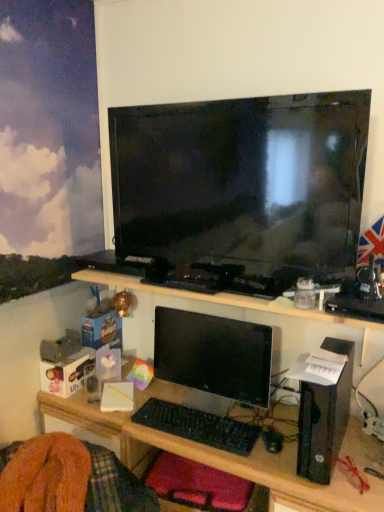
This screenshot has height=512, width=384. I want to click on blank space above black plastic monitor at center (from a real-world perspective), so click(244, 426).